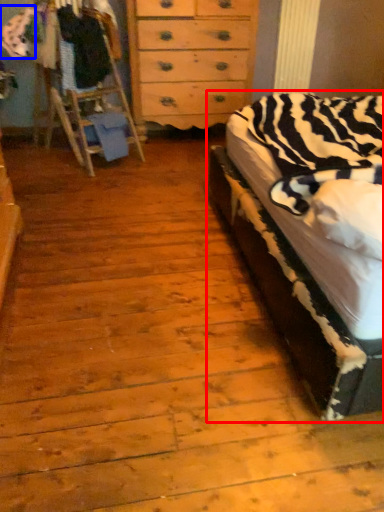
Question: Which of the following is the closest to the observer, bed (highlighted by a red box) or clothing (highlighted by a blue box)?

Choices:
 (A) bed
 (B) clothing

Answer: (A)